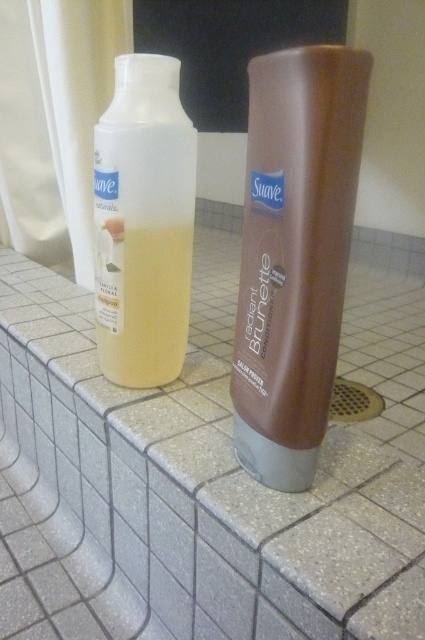
You are trying to place a small decorative plant between the gray speckled tile at center and the brown matte shampoo at center on the bathroom ledge. Based on their widths, can the plant fit between them without overlapping either object?

The gray speckled tile at center might be wider than brown matte shampoo at center, so there is uncertainty about the available space between them. To safely place the plant without overlapping, ensure the total width of both objects allows enough space for the plant.